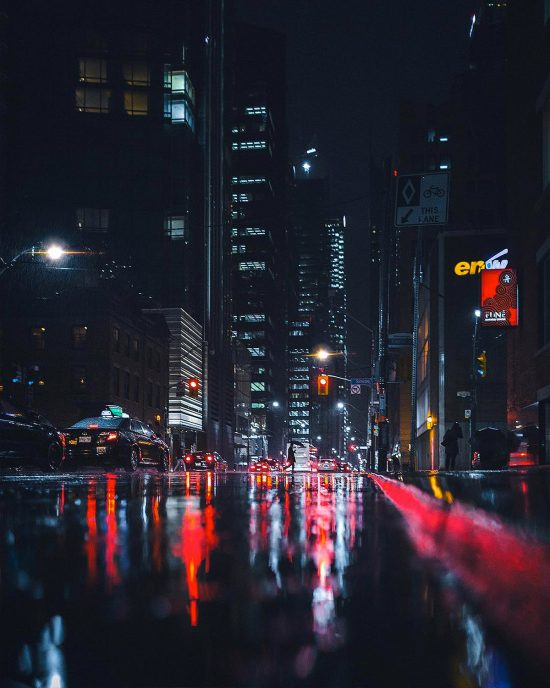
Find the location of a particular element. The image size is (550, 688). windows is located at coordinates (302, 422).